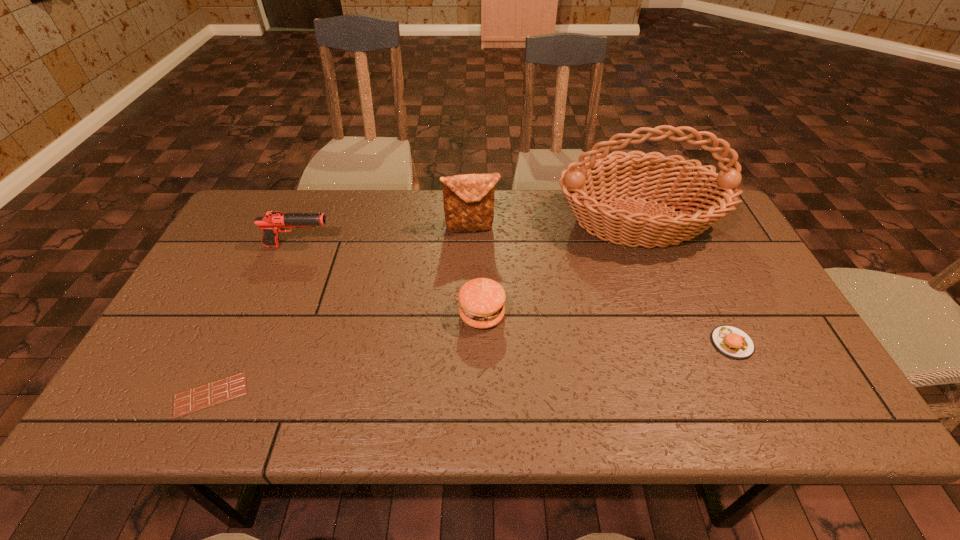
Where is `basket present at the right edge`? The image size is (960, 540). basket present at the right edge is located at coordinates (601, 177).

What are the coordinates of `patty positioned at the right edge` in the screenshot? It's located at (730, 341).

What are the coordinates of `object that is positioned at the near left corner` in the screenshot? It's located at (228, 388).

I want to click on object that is at the far right corner, so click(601, 177).

This screenshot has width=960, height=540. In the image, there is a desktop. Identify the location of free space at the near edge. (720, 393).

Locate an element on the screen. This screenshot has width=960, height=540. vacant space at the left edge of the desktop is located at coordinates (180, 305).

In the image, there is a desktop. Where is `vacant space at the right edge`? vacant space at the right edge is located at coordinates (732, 248).

In the image, there is a desktop. In order to click on vacant space at the far right corner in this screenshot , I will do [x=708, y=229].

The image size is (960, 540). I want to click on vacant region at the near right corner of the desktop, so 830,412.

Locate an element on the screen. This screenshot has width=960, height=540. unoccupied area between the chocolate bar and the fourth shortest object is located at coordinates (254, 320).